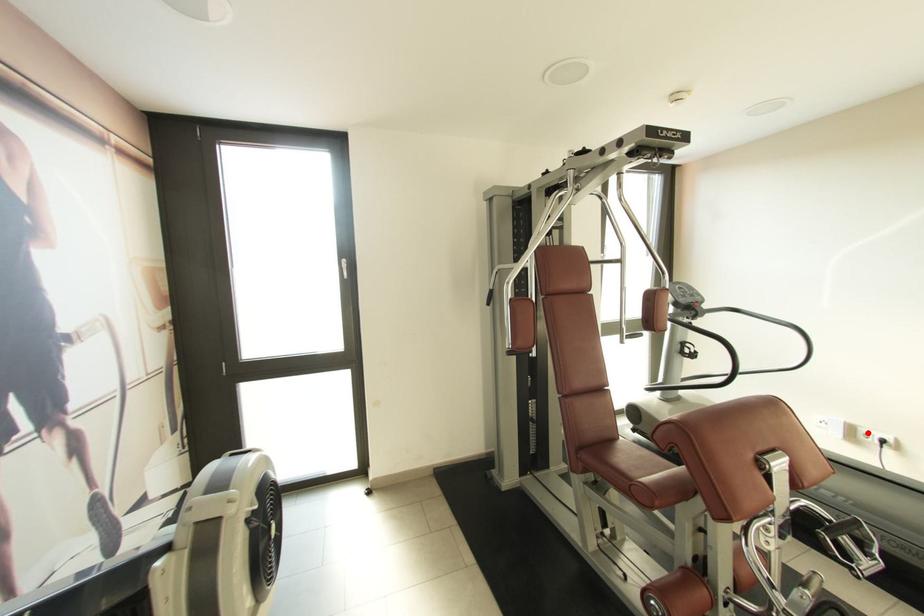
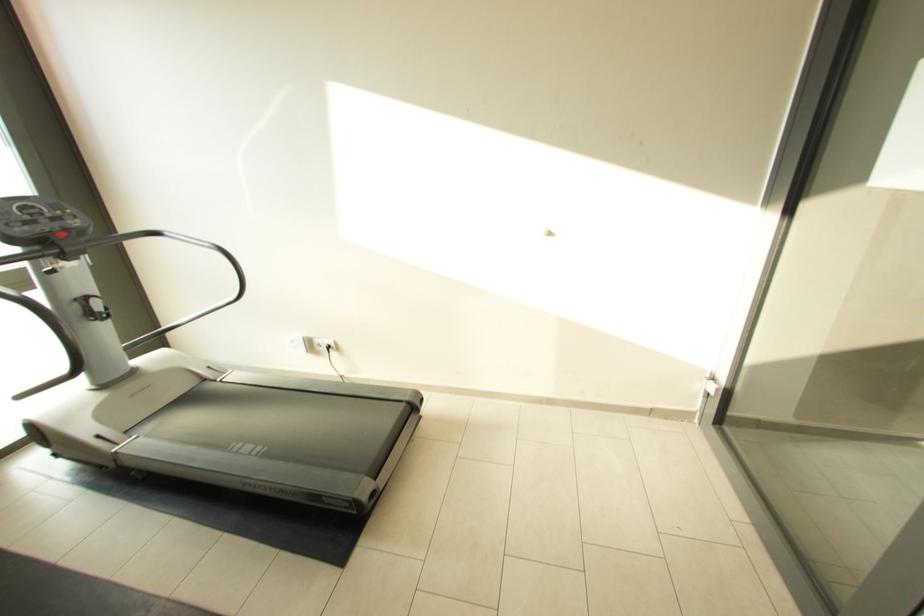
Where in the second image is the point corresponding to the highlighted location from the first image?

(322, 342)